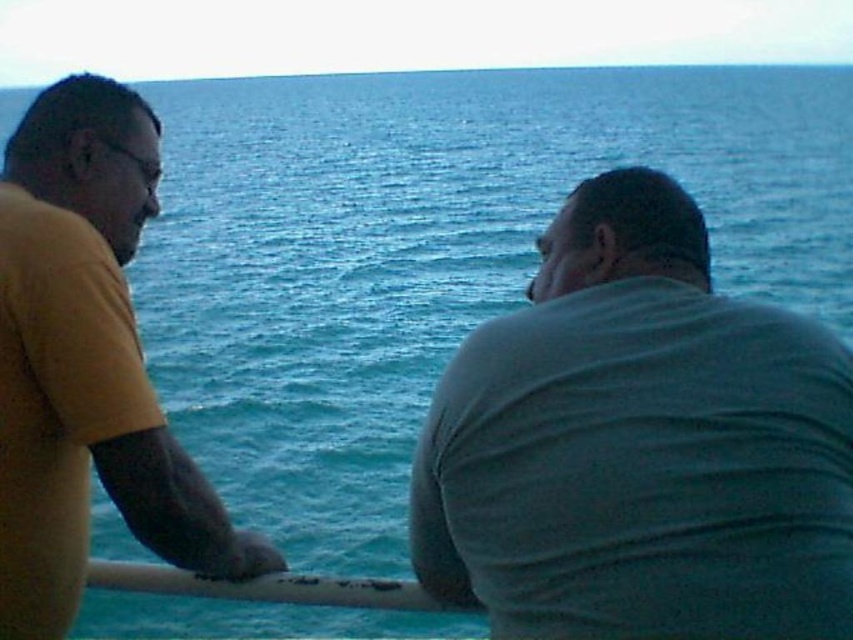
This screenshot has height=640, width=853. What do you see at coordinates (639, 444) in the screenshot?
I see `gray matte shirt at right` at bounding box center [639, 444].

Does point (715, 451) come behind point (381, 605)?

No, it is not.

Who is more forward, [540,353] or [412,598]?

Point [540,353] is in front.

Where is `gray matte shirt at right`? This screenshot has height=640, width=853. gray matte shirt at right is located at coordinates (639, 444).

Does gray matte shirt at right have a greater height compared to matte yellow t-shirt at left?

No.

Is point (670, 326) closer to camera compared to point (54, 436)?

Yes.

At what (x,y) coordinates should I click in order to perform the action: click on gray matte shirt at right. Please return your answer as a coordinate pair (x, y). Looking at the image, I should click on (639, 444).

Does matte yellow t-shirt at left have a larger size compared to white matte rail at center?

Indeed, matte yellow t-shirt at left has a larger size compared to white matte rail at center.

Is matte yellow t-shirt at left taller than white matte rail at center?

Indeed, matte yellow t-shirt at left has a greater height compared to white matte rail at center.

Between point (132, 461) and point (222, 584), which one is positioned behind?

The point (222, 584) is more distant.

This screenshot has height=640, width=853. I want to click on matte yellow t-shirt at left, so click(x=86, y=362).